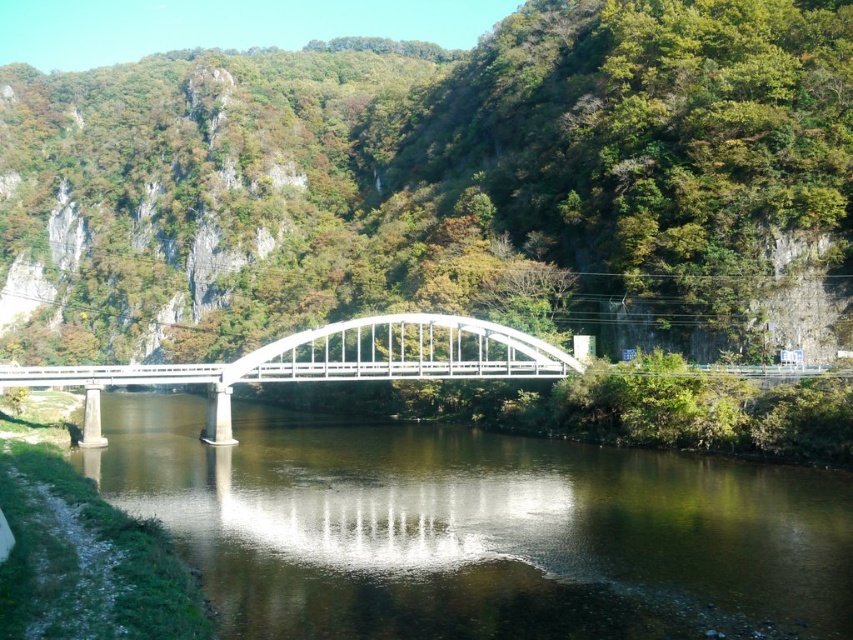
Which is behind, point (424, 528) or point (502, 332)?

Positioned behind is point (502, 332).

Does point (699, 531) come in front of point (323, 365)?

Yes, point (699, 531) is in front of point (323, 365).

Is point (442, 552) farther from viewer compared to point (111, 374)?

No.

Find the location of a particular element. This screenshot has width=853, height=640. greenish-brown water at center is located at coordinates pos(476,529).